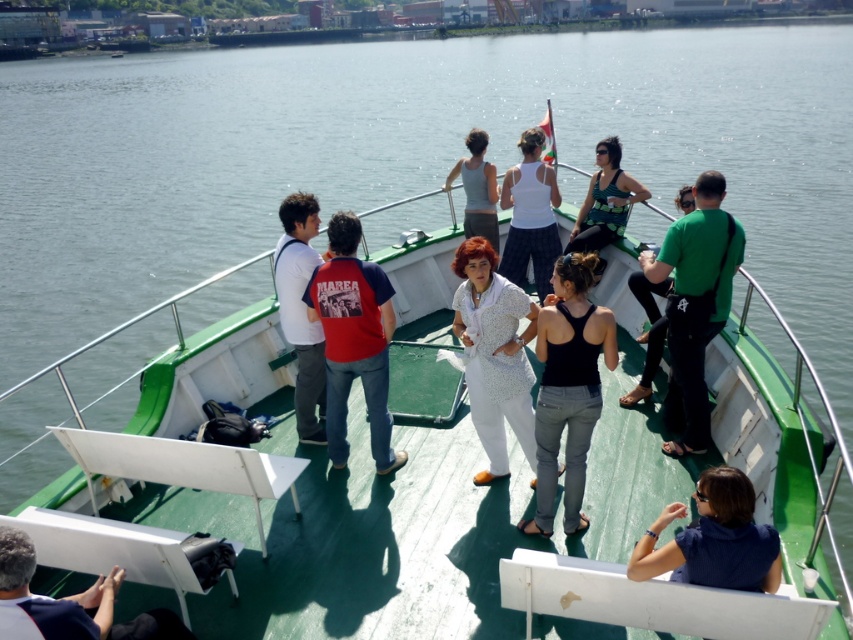
Is blue fabric shirt at lower right bigger than white fabric tank top at center?

No.

Between blue fabric shirt at lower right and white fabric tank top at center, which one appears on the left side from the viewer's perspective?

white fabric tank top at center is more to the left.

This screenshot has width=853, height=640. I want to click on blue fabric shirt at lower right, so click(x=712, y=540).

Is green matte shirt at upper right below red cotton shirt at center?

Actually, green matte shirt at upper right is above red cotton shirt at center.

Is point (680, 230) more distant than point (370, 337)?

No, (680, 230) is closer to viewer.

Is point (688, 397) positioned in front of point (339, 317)?

No, it is not.

The width and height of the screenshot is (853, 640). I want to click on green matte shirt at upper right, so click(695, 305).

Can you confirm if white matte shirt at center is wider than green textured tank top at center?

No.

Between white matte shirt at center and green textured tank top at center, which one has less height?

With less height is green textured tank top at center.

Is point (310, 323) in front of point (587, 234)?

That is True.

You are a GUI agent. You are given a task and a screenshot of the screen. Output one action in this format:
    pyautogui.click(x=<x>, y=<y>)
    Task: Click on the white matte shirt at center
    This screenshot has width=853, height=640.
    Given the screenshot: What is the action you would take?
    pyautogui.click(x=300, y=310)